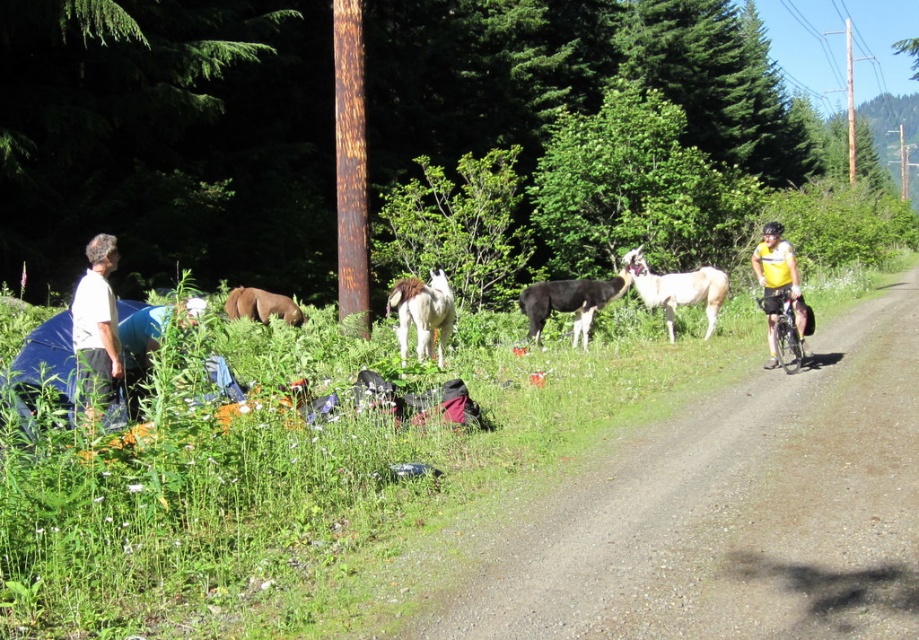
Question: Can you confirm if white cotton shirt at left is thinner than brown fuzzy pony at lower left?

Choices:
 (A) no
 (B) yes

Answer: (B)

Question: Does white fluffy pony at center have a greater width compared to yellow jersey cyclist at right?

Choices:
 (A) yes
 (B) no

Answer: (A)

Question: Which of the following is the closest to the observer?

Choices:
 (A) brown fuzzy pony at lower left
 (B) white fluffy pony at center
 (C) white cotton shirt at left

Answer: (C)

Question: Considering the real-world distances, which object is closest to the white woolen goat at right?

Choices:
 (A) white cotton shirt at left
 (B) black woolen goat at center

Answer: (B)

Question: Is yellow jersey cyclist at right further to camera compared to brown fuzzy pony at lower left?

Choices:
 (A) yes
 (B) no

Answer: (B)

Question: Based on their relative distances, which object is farther from the white fluffy pony at center?

Choices:
 (A) white woolen goat at right
 (B) black woolen goat at center
 (C) brown fuzzy pony at lower left
 (D) white cotton shirt at left

Answer: (D)